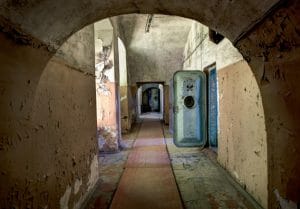
This screenshot has width=300, height=209. Identify the location of column. (118, 91).